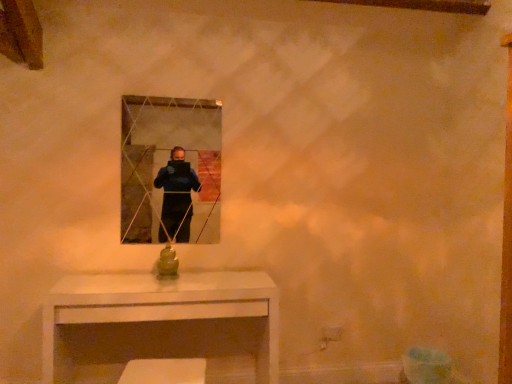
Image resolution: width=512 pixels, height=384 pixels. What do you see at coordinates (162, 325) in the screenshot?
I see `white glossy table at lower center` at bounding box center [162, 325].

The image size is (512, 384). In order to click on white glossy table at lower center in this screenshot , I will do `click(162, 325)`.

Find the location of a particular element. The height and width of the screenshot is (384, 512). clear glass mirror at center is located at coordinates (166, 169).

Describe the element at coordinates (166, 169) in the screenshot. This screenshot has height=384, width=512. I see `clear glass mirror at center` at that location.

Locate an element on the screen. white glossy table at lower center is located at coordinates (162, 325).

Is white glossy table at lower center to the left of clear glass mirror at center from the viewer's perspective?

In fact, white glossy table at lower center is to the right of clear glass mirror at center.

Which object is closer to the camera, white glossy table at lower center or clear glass mirror at center?

white glossy table at lower center is in front.

Which is in front, point (258, 364) or point (132, 165)?

Point (132, 165)

From the image's perspective, is white glossy table at lower center located beneath clear glass mirror at center?

Yes.

From a real-world perspective, is white glossy table at lower center physically below clear glass mirror at center?

Yes, from a real-world perspective, white glossy table at lower center is under clear glass mirror at center.

Can you confirm if white glossy table at lower center is thinner than clear glass mirror at center?

No, white glossy table at lower center is not thinner than clear glass mirror at center.

Can you confirm if white glossy table at lower center is taller than clear glass mirror at center?

No.

Considering the sizes of objects white glossy table at lower center and clear glass mirror at center in the image provided, who is bigger, white glossy table at lower center or clear glass mirror at center?

With larger size is white glossy table at lower center.

Is clear glass mirror at center completely or partially inside white glossy table at lower center?

No, white glossy table at lower center does not contain clear glass mirror at center.

Is white glossy table at lower center positioned far away from clear glass mirror at center?

They are positioned close to each other.

Is white glossy table at lower center turned away from clear glass mirror at center?

No, clear glass mirror at center is not at the back of white glossy table at lower center.

Where is `table below the clear glass mirror at center (from a real-world perspective)`? This screenshot has height=384, width=512. table below the clear glass mirror at center (from a real-world perspective) is located at coordinates (162, 325).

Which is more to the right, clear glass mirror at center or white glossy table at lower center?

Positioned to the right is white glossy table at lower center.

Does clear glass mirror at center come in front of white glossy table at lower center?

No.

Is point (176, 149) behind point (105, 350)?

Yes, point (176, 149) is behind point (105, 350).

From the image's perspective, is clear glass mirror at center located above or below white glossy table at lower center?

Based on their image positions, clear glass mirror at center is located above white glossy table at lower center.

From a real-world perspective, is clear glass mirror at center on white glossy table at lower center?

Yes.

In terms of width, does clear glass mirror at center look wider or thinner when compared to white glossy table at lower center?

Clearly, clear glass mirror at center has less width compared to white glossy table at lower center.

In terms of height, does clear glass mirror at center look taller or shorter compared to white glossy table at lower center?

Considering their sizes, clear glass mirror at center has more height than white glossy table at lower center.

Considering the sizes of objects clear glass mirror at center and white glossy table at lower center in the image provided, who is bigger, clear glass mirror at center or white glossy table at lower center?

Bigger between the two is white glossy table at lower center.

Is clear glass mirror at center spatially inside white glossy table at lower center, or outside of it?

clear glass mirror at center is located beyond the bounds of white glossy table at lower center.

Is clear glass mirror at center directly adjacent to white glossy table at lower center?

clear glass mirror at center and white glossy table at lower center are clearly separated.

Is clear glass mirror at center turned away from white glossy table at lower center?

No, clear glass mirror at center's orientation is not away from white glossy table at lower center.

Measure the distance between clear glass mirror at center and white glossy table at lower center.

58.12 centimeters.

This screenshot has width=512, height=384. Identify the location of mirror above the white glossy table at lower center (from a real-world perspective). (166, 169).

You are a GUI agent. You are given a task and a screenshot of the screen. Output one action in this format:
    pyautogui.click(x=<x>, y=<y>)
    Task: Click on the table below the clear glass mirror at center (from the image's perspective)
    The height and width of the screenshot is (384, 512).
    Given the screenshot: What is the action you would take?
    pyautogui.click(x=162, y=325)

This screenshot has width=512, height=384. I want to click on table on the right of the clear glass mirror at center, so click(162, 325).